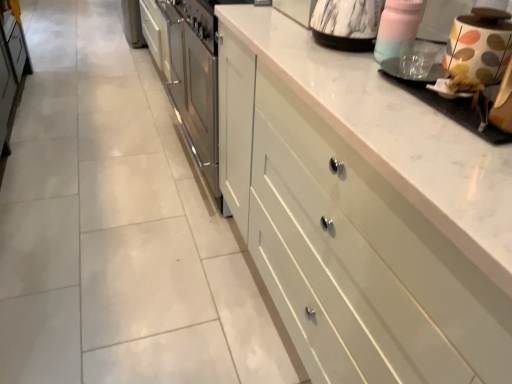
Question: Is polka dot ceramic jar at upper right, acting as the 3th appliance starting from the left, oriented towards white painted wood drawers at center?

Choices:
 (A) yes
 (B) no

Answer: (B)

Question: Is polka dot ceramic jar at upper right, which is the 1th appliance from right to left, far away from white painted wood drawers at center?

Choices:
 (A) no
 (B) yes

Answer: (A)

Question: Is polka dot ceramic jar at upper right, which is the 1th appliance from right to left, in contact with white painted wood drawers at center?

Choices:
 (A) yes
 (B) no

Answer: (B)

Question: Is polka dot ceramic jar at upper right, which is the 1th appliance from right to left, at the right side of white painted wood drawers at center?

Choices:
 (A) no
 (B) yes

Answer: (B)

Question: Can you confirm if polka dot ceramic jar at upper right, which is the 1th appliance from right to left, is smaller than white painted wood drawers at center?

Choices:
 (A) yes
 (B) no

Answer: (A)

Question: Can you confirm if polka dot ceramic jar at upper right, acting as the 3th appliance starting from the left, is positioned to the left of white painted wood drawers at center?

Choices:
 (A) no
 (B) yes

Answer: (A)

Question: Would you say transparent plastic cup at upper right, which is counted as the second appliance, starting from the left, is outside white glossy coffee machine at upper right?

Choices:
 (A) yes
 (B) no

Answer: (A)

Question: Does transparent plastic cup at upper right, which is counted as the second appliance, starting from the left, lie behind white glossy coffee machine at upper right?

Choices:
 (A) yes
 (B) no

Answer: (A)

Question: Is transparent plastic cup at upper right, which is counted as the second appliance, starting from the left, oriented towards white glossy coffee machine at upper right?

Choices:
 (A) yes
 (B) no

Answer: (B)

Question: Is transparent plastic cup at upper right, which is counted as the second appliance, starting from the left, surrounding white glossy coffee machine at upper right?

Choices:
 (A) yes
 (B) no

Answer: (B)

Question: Can you confirm if transparent plastic cup at upper right, which appears as the 2th appliance when viewed from the right, is smaller than white glossy coffee machine at upper right?

Choices:
 (A) no
 (B) yes

Answer: (B)

Question: From a real-world perspective, is transparent plastic cup at upper right, which is counted as the second appliance, starting from the left, below white glossy coffee machine at upper right?

Choices:
 (A) no
 (B) yes

Answer: (A)

Question: Is white glossy coffee machine at upper right positioned with its back to transparent plastic cup at upper right, which is counted as the second appliance, starting from the left?

Choices:
 (A) yes
 (B) no

Answer: (B)